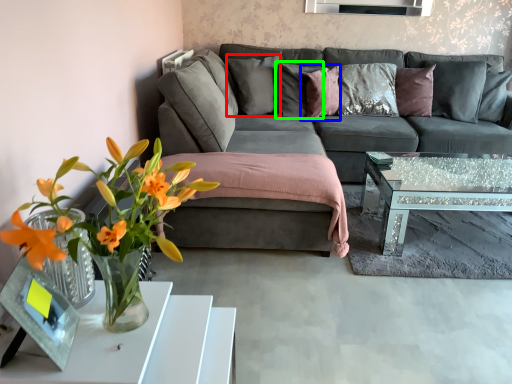
Question: Which object is positioned farthest from pillow (highlighted by a red box)? Select from pillow (highlighted by a blue box) and pillow (highlighted by a green box).

Choices:
 (A) pillow
 (B) pillow

Answer: (A)